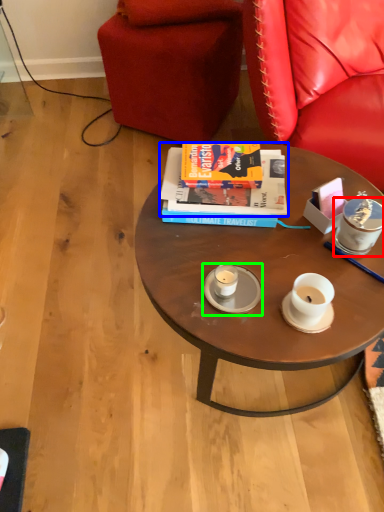
Question: Estimate the real-world distances between objects in this image. Which object is closer to coffee cup (highlighted by a red box), book (highlighted by a blue box) or saucer (highlighted by a green box)?

Choices:
 (A) book
 (B) saucer

Answer: (A)